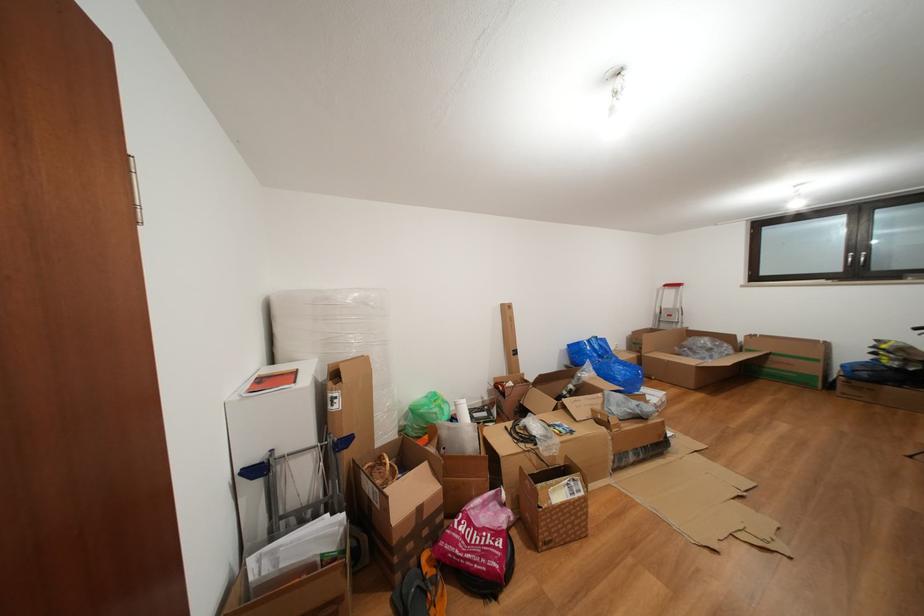
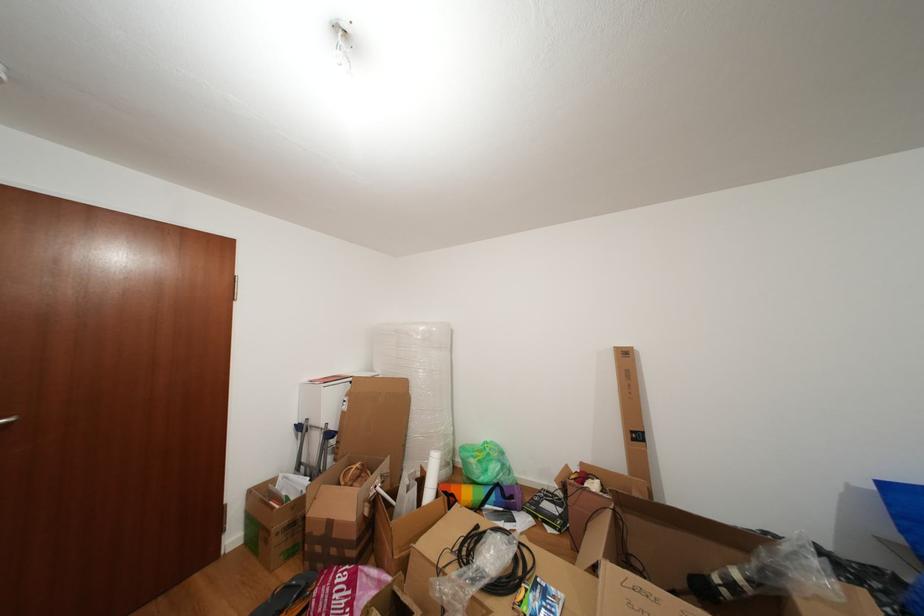
Find the pixel in the second image that matches (x=428, y=515) in the first image.

(338, 529)